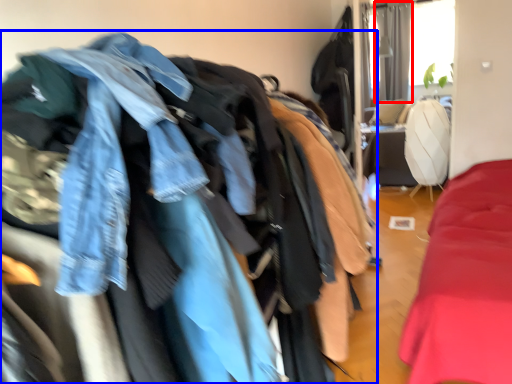
Question: Which point is further to the camera, curtain (highlighted by a red box) or jacket (highlighted by a blue box)?

Choices:
 (A) curtain
 (B) jacket

Answer: (A)